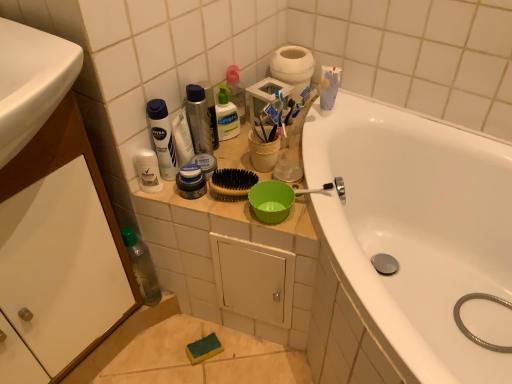
The width and height of the screenshot is (512, 384). What do you see at coordinates (234, 90) in the screenshot?
I see `translucent plastic bottle at upper center, acting as the first cleaning product starting from the right` at bounding box center [234, 90].

I want to click on transparent plastic bottle at lower left, so click(x=142, y=267).

At what (x,y) coordinates should I click in order to perform the action: click on clear plastic bottle at upper center, which is the 3th cleaning product from left to right. Please return your answer as a coordinate pair (x, y). Image resolution: width=512 pixels, height=384 pixels. Looking at the image, I should click on (226, 115).

Image resolution: width=512 pixels, height=384 pixels. Find the location of `white matte toothpaste at upper center`. white matte toothpaste at upper center is located at coordinates point(271,115).

Between clear plastic bottle at upper center, which is the 3th cleaning product from left to right, and metallic silver spray can at upper center, arranged as the second cleaning product when viewed from the left, which one has more height?

With more height is metallic silver spray can at upper center, arranged as the second cleaning product when viewed from the left.

From a real-world perspective, which is physically above, clear plastic bottle at upper center, which is the 3th cleaning product from left to right, or metallic silver spray can at upper center, arranged as the second cleaning product when viewed from the left?

From a 3D spatial view, metallic silver spray can at upper center, arranged as the second cleaning product when viewed from the left, is above.

Is clear plastic bottle at upper center, the 2th cleaning product in the right-to-left sequence, facing towards metallic silver spray can at upper center, arranged as the third cleaning product when viewed from the right?

No, clear plastic bottle at upper center, the 2th cleaning product in the right-to-left sequence, is not oriented towards metallic silver spray can at upper center, arranged as the third cleaning product when viewed from the right.

Considering the relative sizes of clear plastic bottle at upper center, the 2th cleaning product in the right-to-left sequence, and metallic silver spray can at upper center, arranged as the third cleaning product when viewed from the right, in the image provided, is clear plastic bottle at upper center, the 2th cleaning product in the right-to-left sequence, thinner than metallic silver spray can at upper center, arranged as the third cleaning product when viewed from the right,?

Yes.

Does point (126, 238) come in front of point (186, 109)?

No, it is not.

From the image's perspective, is transparent plastic bottle at lower left located above metallic silver spray can at upper center, arranged as the second cleaning product when viewed from the left?

No, from the image's perspective, transparent plastic bottle at lower left is not above metallic silver spray can at upper center, arranged as the second cleaning product when viewed from the left.

Is transparent plastic bottle at lower left positioned with its back to metallic silver spray can at upper center, arranged as the second cleaning product when viewed from the left?

That's not correct — transparent plastic bottle at lower left is not looking away from metallic silver spray can at upper center, arranged as the second cleaning product when viewed from the left.

Considering the sizes of transparent plastic bottle at lower left and metallic silver spray can at upper center, arranged as the second cleaning product when viewed from the left, in the image, is transparent plastic bottle at lower left wider or thinner than metallic silver spray can at upper center, arranged as the second cleaning product when viewed from the left,?

In the image, transparent plastic bottle at lower left appears to be wider than metallic silver spray can at upper center, arranged as the second cleaning product when viewed from the left.

Which is less distant, (161, 180) or (156, 280)?

The point (161, 180) is closer to the camera.

From the image's perspective, who appears lower, clear plastic shaving cream canister at upper left or transparent plastic bottle at lower left?

transparent plastic bottle at lower left is shown below in the image.

Between clear plastic shaving cream canister at upper left and transparent plastic bottle at lower left, which one has larger size?

Bigger between the two is transparent plastic bottle at lower left.

Which of these two, clear plastic shaving cream canister at upper left or transparent plastic bottle at lower left, stands shorter?

Standing shorter between the two is clear plastic shaving cream canister at upper left.

Which is correct: clear plastic bottle at upper center, which is the 3th cleaning product from left to right, is inside clear plastic shaving cream canister at upper left, or outside of it?

clear plastic bottle at upper center, which is the 3th cleaning product from left to right, cannot be found inside clear plastic shaving cream canister at upper left.

Considering the points (216, 104) and (142, 176), which point is in front, point (216, 104) or point (142, 176)?

The point (142, 176) is closer to the camera.

Consider the image. Considering the relative positions of clear plastic bottle at upper center, which is the 3th cleaning product from left to right, and clear plastic shaving cream canister at upper left in the image provided, is clear plastic bottle at upper center, which is the 3th cleaning product from left to right, to the right of clear plastic shaving cream canister at upper left from the viewer's perspective?

Yes.

Does point (153, 167) lie behind point (291, 51)?

No.

Which object is thinner, clear plastic shaving cream canister at upper left or white cardboard toilet paper at upper center?

Thinner between the two is clear plastic shaving cream canister at upper left.

Could you tell me if clear plastic shaving cream canister at upper left is turned towards white cardboard toilet paper at upper center?

No, clear plastic shaving cream canister at upper left is not aimed at white cardboard toilet paper at upper center.

Looking at the image, does matte blue cream at center, the second personal care from the top, seem bigger or smaller compared to metallic silver can at upper center, which appears as the second personal care when ordered from the bottom?

Clearly, matte blue cream at center, the second personal care from the top, is smaller in size than metallic silver can at upper center, which appears as the second personal care when ordered from the bottom.

How many degrees apart are the facing directions of matte blue cream at center, the second personal care from the top, and metallic silver can at upper center, which appears as the second personal care when ordered from the bottom?

There is a 0.000848-degree angle between the facing directions of matte blue cream at center, the second personal care from the top, and metallic silver can at upper center, which appears as the second personal care when ordered from the bottom.

Looking at this image, is matte blue cream at center, the second personal care from the top, not near metallic silver can at upper center, the first personal care when ordered from top to bottom?

Actually, matte blue cream at center, the second personal care from the top, and metallic silver can at upper center, the first personal care when ordered from top to bottom, are a little close together.

How much distance is there between matte blue cream at center, the first personal care positioned from the bottom, and metallic silver can at upper center, the first personal care when ordered from top to bottom?

A distance of 6.55 inches exists between matte blue cream at center, the first personal care positioned from the bottom, and metallic silver can at upper center, the first personal care when ordered from top to bottom.

Between translucent plastic bottle at upper center, acting as the 4th cleaning product starting from the left, and metallic silver can at upper center, the first personal care when ordered from top to bottom, which one has less height?

translucent plastic bottle at upper center, acting as the 4th cleaning product starting from the left.

Looking at their sizes, would you say translucent plastic bottle at upper center, acting as the first cleaning product starting from the right, is wider or thinner than metallic silver can at upper center, the first personal care when ordered from top to bottom?

translucent plastic bottle at upper center, acting as the first cleaning product starting from the right, is thinner than metallic silver can at upper center, the first personal care when ordered from top to bottom.

The width and height of the screenshot is (512, 384). I want to click on personal care that is above the translucent plastic bottle at upper center, acting as the first cleaning product starting from the right (from a real-world perspective), so click(x=210, y=110).

From a real-world perspective, is translucent plastic bottle at upper center, acting as the 4th cleaning product starting from the left, positioned above or below metallic silver can at upper center, which appears as the second personal care when ordered from the bottom?

From a real-world perspective, translucent plastic bottle at upper center, acting as the 4th cleaning product starting from the left, is physically below metallic silver can at upper center, which appears as the second personal care when ordered from the bottom.

What are the coordinates of `the 1st cleaning product counting from the right side of the metallic silver spray can at upper center, arranged as the second cleaning product when viewed from the left` in the screenshot? It's located at (226, 115).

Image resolution: width=512 pixels, height=384 pixels. I want to click on the 4th cleaning product located above the transparent plastic bottle at lower left (from a real-world perspective), so click(x=198, y=119).

From the image, which object appears to be nearer to transparent plastic bottle at lower left, translucent plastic bottle at upper center, acting as the first cleaning product starting from the right, or clear plastic bottle at upper center, the 2th cleaning product in the right-to-left sequence?

Among the two, clear plastic bottle at upper center, the 2th cleaning product in the right-to-left sequence, is located nearer to transparent plastic bottle at lower left.

When comparing their distances from white glossy bathtub at upper right, does white matte toothpaste at upper center or clear plastic bottle at upper center, the 2th cleaning product in the right-to-left sequence, seem further?

Based on the image, clear plastic bottle at upper center, the 2th cleaning product in the right-to-left sequence, appears to be further to white glossy bathtub at upper right.

Looking at the image, which one is located closer to translucent plastic bottle at upper center, acting as the first cleaning product starting from the right, white cardboard toilet paper at upper center or white matte deodorant at upper center, the 1th cleaning product in the left-to-right sequence?

Based on the image, white cardboard toilet paper at upper center appears to be nearer to translucent plastic bottle at upper center, acting as the first cleaning product starting from the right.

Which object lies further to the anchor point transparent plastic bottle at lower left, white matte deodorant at upper center, the 1th cleaning product in the left-to-right sequence, or white cardboard toilet paper at upper center?

The object further to transparent plastic bottle at lower left is white cardboard toilet paper at upper center.

From the image, which object appears to be farther from white cardboard toilet paper at upper center, clear plastic shaving cream canister at upper left or translucent plastic bottle at upper center, acting as the 4th cleaning product starting from the left?

Based on the image, clear plastic shaving cream canister at upper left appears to be further to white cardboard toilet paper at upper center.

Estimate the real-world distances between objects in this image. Which object is further from white matte deodorant at upper center, the fourth cleaning product from the right, translucent plastic bottle at upper center, acting as the 4th cleaning product starting from the left, or matte blue cream at center, the first personal care positioned from the bottom?

translucent plastic bottle at upper center, acting as the 4th cleaning product starting from the left, is positioned further to the anchor white matte deodorant at upper center, the fourth cleaning product from the right.

Which object lies nearer to the anchor point white glossy bathtub at upper right, white matte toothpaste at upper center or transparent plastic bottle at lower left?

Based on the image, white matte toothpaste at upper center appears to be nearer to white glossy bathtub at upper right.

From the image, which object appears to be farther from white glossy bathtub at upper right, white matte toothpaste at upper center or clear plastic shaving cream canister at upper left?

The object further to white glossy bathtub at upper right is clear plastic shaving cream canister at upper left.

Locate an element on the screen. This screenshot has height=384, width=512. toiletry between clear plastic bottle at upper center, the 2th cleaning product in the right-to-left sequence, and matte blue cream at center, the first personal care positioned from the bottom, in the vertical direction is located at coordinates (148, 171).

Find the location of a particular element. toiletry between translucent plastic bottle at upper center, acting as the first cleaning product starting from the right, and transparent plastic bottle at lower left in the up-down direction is located at coordinates (148, 171).

Where is `toiletry between metallic silver spray can at upper center, arranged as the second cleaning product when viewed from the left, and matte blue cream at center, the second personal care from the top, in the vertical direction`? toiletry between metallic silver spray can at upper center, arranged as the second cleaning product when viewed from the left, and matte blue cream at center, the second personal care from the top, in the vertical direction is located at coordinates (148, 171).

Locate an element on the screen. The width and height of the screenshot is (512, 384). toiletry between white matte deodorant at upper center, the 1th cleaning product in the left-to-right sequence, and transparent plastic bottle at lower left from top to bottom is located at coordinates (148, 171).